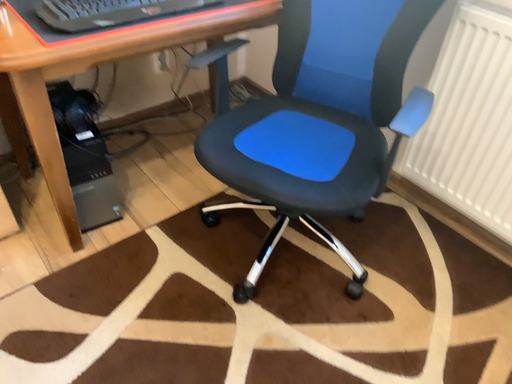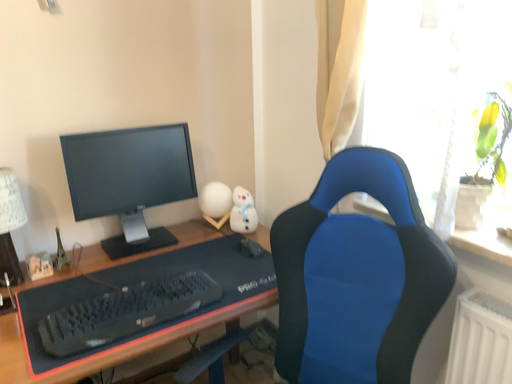
Question: How did the camera likely rotate when shooting the video?

Choices:
 (A) rotated left
 (B) rotated right

Answer: (A)